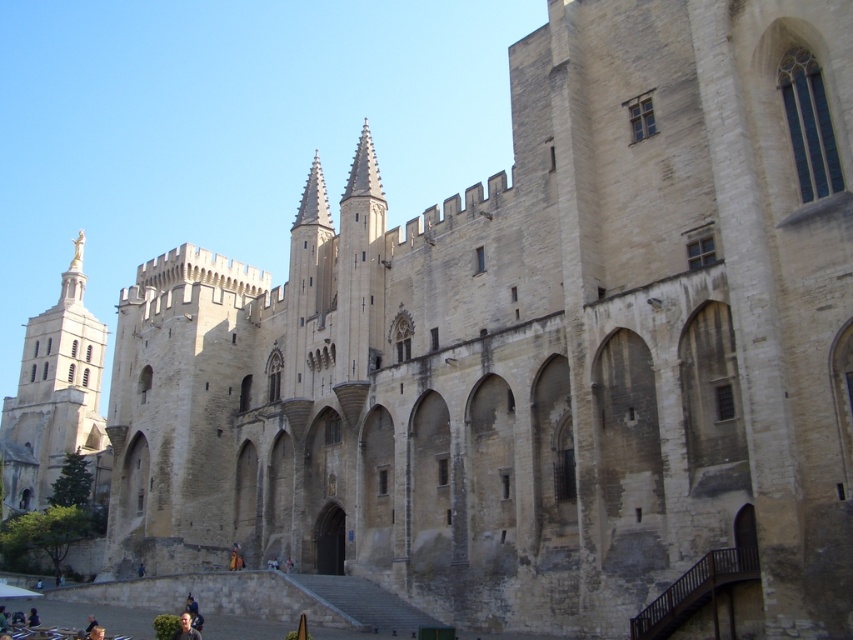
Consider the image. Which is more to the right, golden statue at left or light brown leather jacket at lower center?

From the viewer's perspective, light brown leather jacket at lower center appears more on the right side.

Is golden statue at left below light brown leather jacket at lower center?

No, golden statue at left is not below light brown leather jacket at lower center.

What do you see at coordinates (56, 397) in the screenshot? I see `golden statue at left` at bounding box center [56, 397].

You are a GUI agent. You are given a task and a screenshot of the screen. Output one action in this format:
    pyautogui.click(x=<x>, y=<y>)
    Task: Click on the golden statue at left
    The height and width of the screenshot is (640, 853).
    Given the screenshot: What is the action you would take?
    pyautogui.click(x=56, y=397)